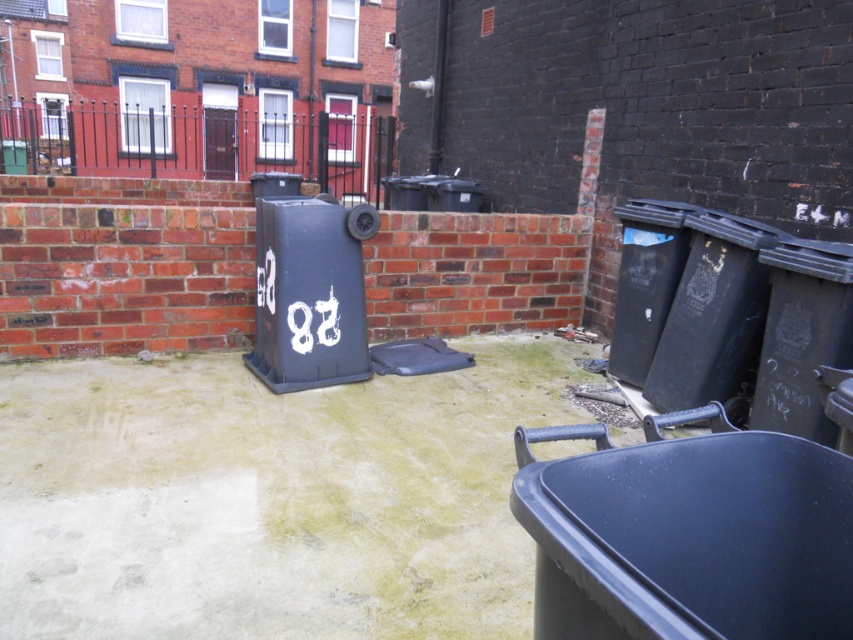
Which is more to the left, matte black bin at lower right or matte black recycling bin at center?

matte black recycling bin at center is more to the left.

Does matte black bin at lower right have a lesser height compared to matte black recycling bin at center?

Correct, matte black bin at lower right is not as tall as matte black recycling bin at center.

Does point (563, 474) come in front of point (285, 253)?

Yes.

Find the location of `matte black bin at lower right`. matte black bin at lower right is located at coordinates (688, 534).